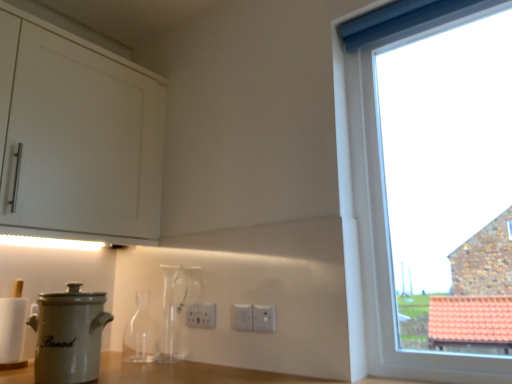
Question: Is white plastic electric outlet at center, positioned as the third electric outlet in front-to-back order, bigger than white plastic electric outlet at center, which is the 2th electric outlet in back-to-front order?

Choices:
 (A) no
 (B) yes

Answer: (B)

Question: Considering the relative positions of white plastic electric outlet at center, marked as the 1th electric outlet in a back-to-front arrangement, and white plastic electric outlet at center, the second electric outlet positioned from the right, in the image provided, is white plastic electric outlet at center, marked as the 1th electric outlet in a back-to-front arrangement, to the right of white plastic electric outlet at center, the second electric outlet positioned from the right, from the viewer's perspective?

Choices:
 (A) yes
 (B) no

Answer: (B)

Question: From a real-world perspective, does white plastic electric outlet at center, placed as the first electric outlet when sorted from left to right, sit lower than white plastic electric outlet at center, the second electric outlet in the front-to-back sequence?

Choices:
 (A) yes
 (B) no

Answer: (B)

Question: From a real-world perspective, is white plastic electric outlet at center, positioned as the third electric outlet in front-to-back order, over white plastic electric outlet at center, the second electric outlet positioned from the right?

Choices:
 (A) yes
 (B) no

Answer: (A)

Question: Is white plastic electric outlet at center, placed as the first electric outlet when sorted from left to right, facing away from white plastic electric outlet at center, which is the 2th electric outlet in back-to-front order?

Choices:
 (A) yes
 (B) no

Answer: (B)

Question: Is white ceramic bread bin at lower left taller or shorter than white plastic electric outlet at center, marked as the 1th electric outlet in a back-to-front arrangement?

Choices:
 (A) short
 (B) tall

Answer: (B)

Question: Considering the positions of white ceramic bread bin at lower left and white plastic electric outlet at center, marked as the 3th electric outlet in a right-to-left arrangement, in the image, is white ceramic bread bin at lower left wider or thinner than white plastic electric outlet at center, marked as the 3th electric outlet in a right-to-left arrangement,?

Choices:
 (A) thin
 (B) wide

Answer: (B)

Question: Is white ceramic bread bin at lower left bigger or smaller than white plastic electric outlet at center, positioned as the third electric outlet in front-to-back order?

Choices:
 (A) big
 (B) small

Answer: (A)

Question: Would you say white ceramic bread bin at lower left is to the left or to the right of white plastic electric outlet at center, positioned as the third electric outlet in front-to-back order, in the picture?

Choices:
 (A) right
 (B) left

Answer: (B)

Question: Is point (145, 345) positioned closer to the camera than point (258, 314)?

Choices:
 (A) closer
 (B) farther

Answer: (B)

Question: Would you say transparent glass bottle at center, the 2th bottle viewed from the right, is to the left or to the right of white plastic electric outlet at center, the third electric outlet positioned from the back, in the picture?

Choices:
 (A) right
 (B) left

Answer: (B)

Question: Is transparent glass bottle at center, the 2th bottle viewed from the right, spatially inside white plastic electric outlet at center, which ranks as the third electric outlet in left-to-right order, or outside of it?

Choices:
 (A) outside
 (B) inside

Answer: (A)

Question: Considering the positions of transparent glass bottle at center, the 2th bottle viewed from the right, and white plastic electric outlet at center, which ranks as the third electric outlet in left-to-right order, in the image, is transparent glass bottle at center, the 2th bottle viewed from the right, wider or thinner than white plastic electric outlet at center, which ranks as the third electric outlet in left-to-right order,?

Choices:
 (A) wide
 (B) thin

Answer: (A)

Question: In terms of width, does transparent glass bottle at center, which is the first bottle in left-to-right order, look wider or thinner when compared to white plastic electric outlet at center, marked as the 3th electric outlet in a right-to-left arrangement?

Choices:
 (A) wide
 (B) thin

Answer: (A)

Question: Is point click(122, 342) closer or farther from the camera than point click(190, 324)?

Choices:
 (A) farther
 (B) closer

Answer: (A)